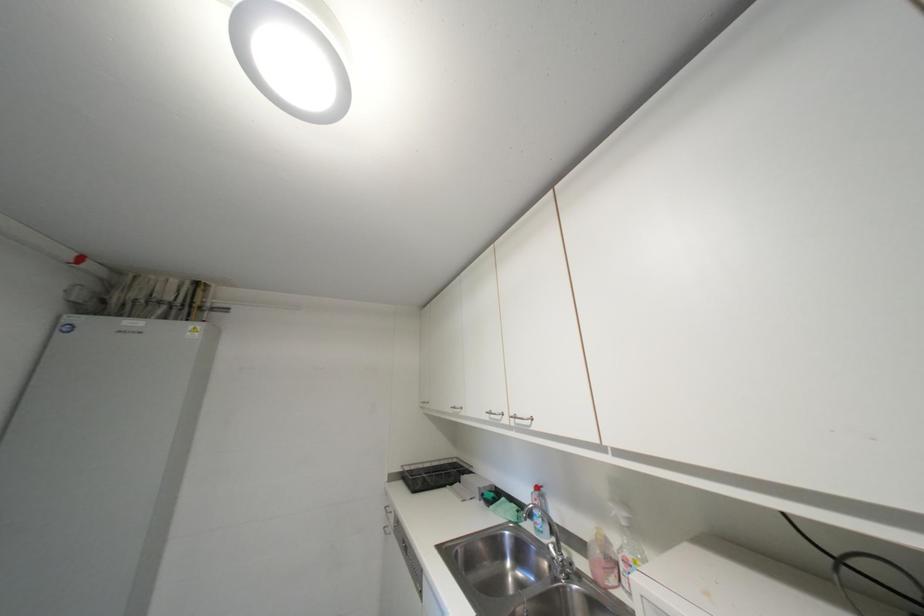
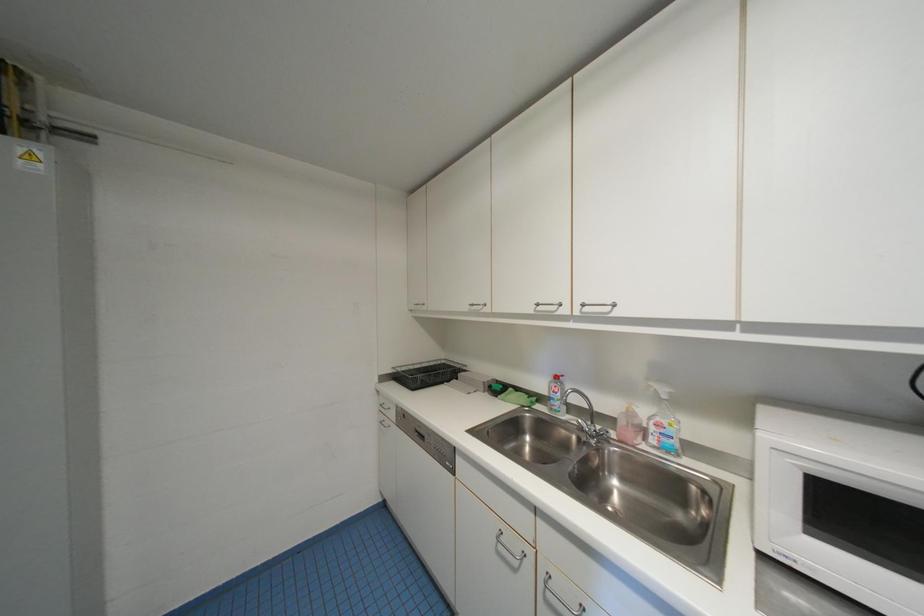
Question: The first image is from the beginning of the video and the second image is from the end. How did the camera likely rotate when shooting the video?

Choices:
 (A) Left
 (B) Right
 (C) Up
 (D) Down

Answer: (D)